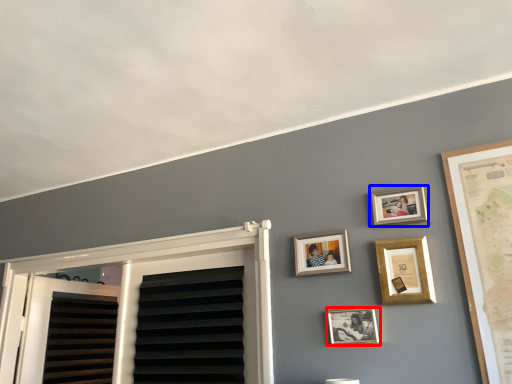
Question: Among these objects, which one is nearest to the camera, picture frame (highlighted by a red box) or picture frame (highlighted by a blue box)?

Choices:
 (A) picture frame
 (B) picture frame

Answer: (A)